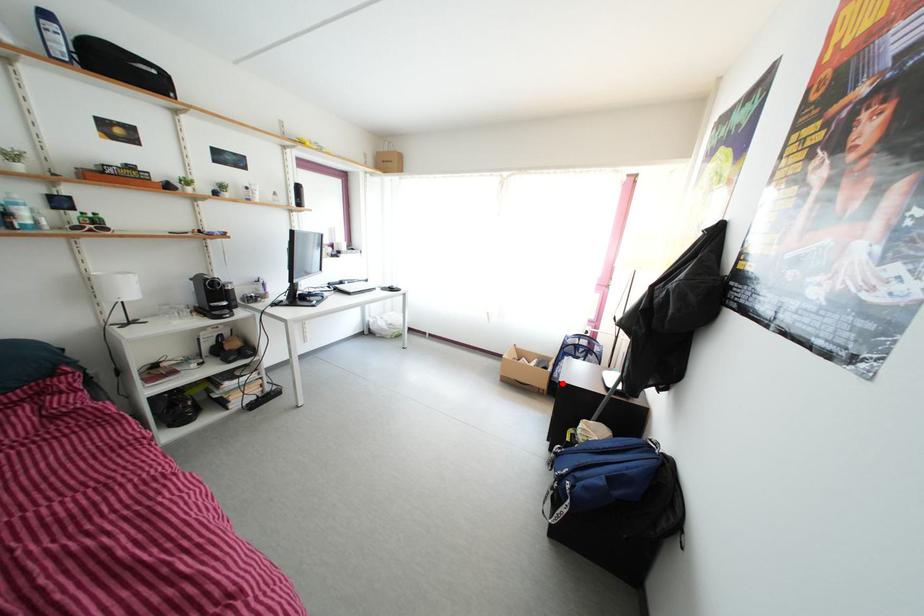
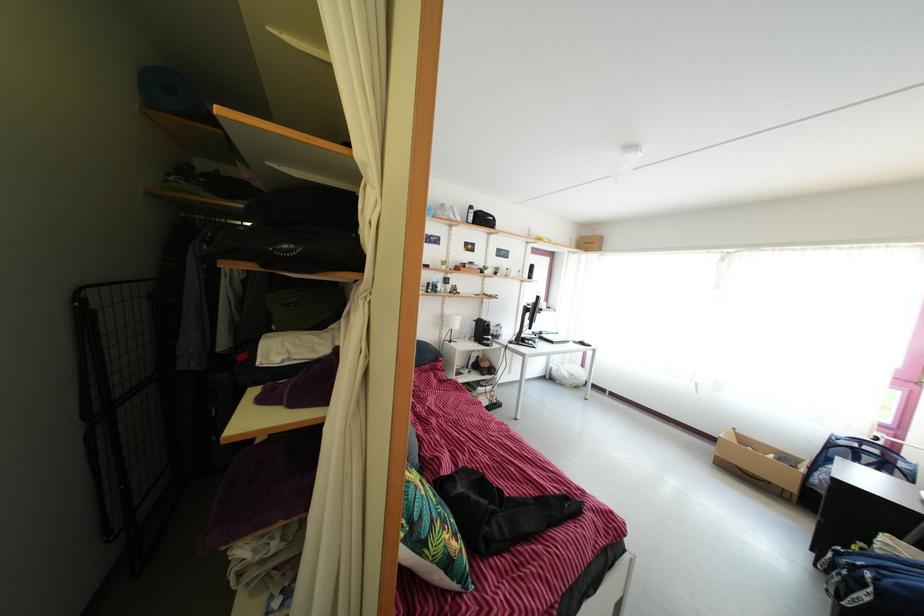
Question: I am providing you with two images of the same scene from different viewpoints. A red point is shown in image1. For the corresponding object point in image2, is it positioned nearer or farther from the camera?

Choices:
 (A) Nearer
 (B) Farther

Answer: (B)